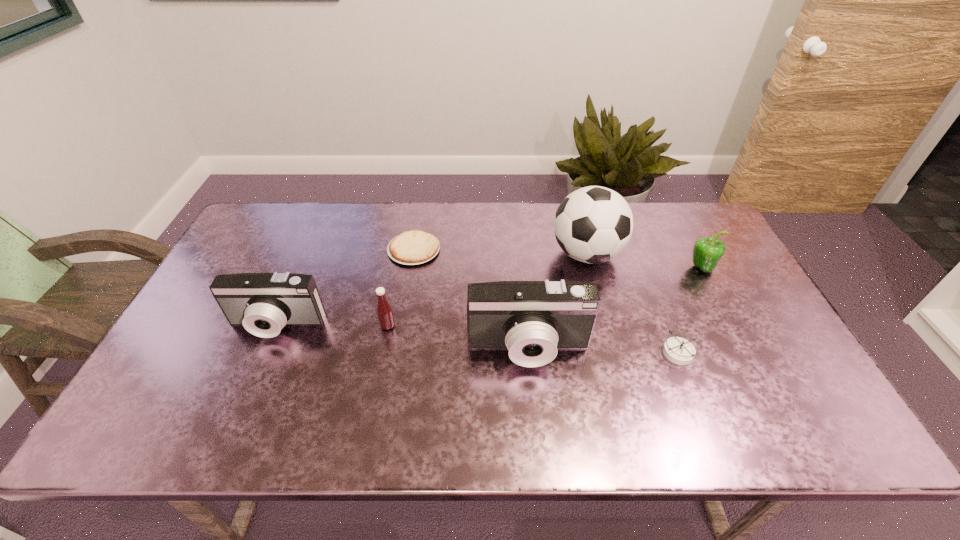
The image size is (960, 540). Find the location of `free point between the second shortest object and the soccer ball`. free point between the second shortest object and the soccer ball is located at coordinates (632, 303).

Where is `empty space between the shortest object and the tallest object`? This screenshot has height=540, width=960. empty space between the shortest object and the tallest object is located at coordinates (500, 252).

Find the location of `vacant area between the shortest object and the Tabasco sauce`. vacant area between the shortest object and the Tabasco sauce is located at coordinates (401, 287).

At what (x,y) coordinates should I click in order to perform the action: click on vacant area between the Tabasco sauce and the shorter camcorder. Please return your answer as a coordinate pair (x, y). Looking at the image, I should click on (332, 326).

Identify which object is located as the second nearest to the soccer ball. Please provide its 2D coordinates. Your answer should be formatted as a tuple, i.e. [(x, y)], where the tuple contains the x and y coordinates of a point satisfying the conditions above.

[(532, 319)]

Select which object appears as the closest to the second object from right to left. Please provide its 2D coordinates. Your answer should be formatted as a tuple, i.e. [(x, y)], where the tuple contains the x and y coordinates of a point satisfying the conditions above.

[(532, 319)]

This screenshot has height=540, width=960. In order to click on vacant space that satisfies the following two spatial constraints: 1. on the back side of the Tabasco sauce; 2. on the left side of the shortest object in this screenshot , I will do (x=402, y=249).

Locate an element on the screen. The height and width of the screenshot is (540, 960). vacant region that satisfies the following two spatial constraints: 1. on the lens of the left camcorder; 2. on the right side of the second shortest object is located at coordinates (265, 352).

The width and height of the screenshot is (960, 540). In order to click on vacant region that satisfies the following two spatial constraints: 1. on the front side of the compass; 2. on the left side of the Tabasco sauce in this screenshot , I will do [x=383, y=352].

The height and width of the screenshot is (540, 960). Identify the location of vacant space that satisfies the following two spatial constraints: 1. on the front side of the sixth tallest object; 2. on the right side of the tortilla. (x=396, y=352).